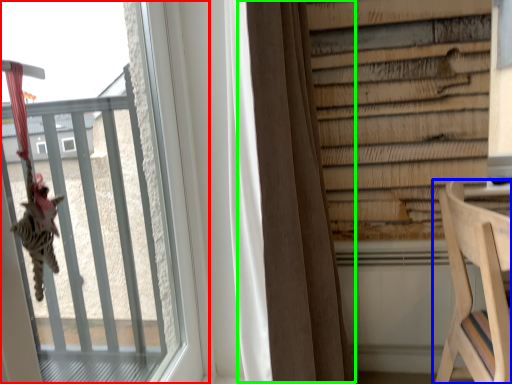
Question: Based on their relative distances, which object is nearer to window (highlighted by a red box)? Choose from furniture (highlighted by a blue box) and curtain (highlighted by a green box).

Choices:
 (A) furniture
 (B) curtain

Answer: (B)